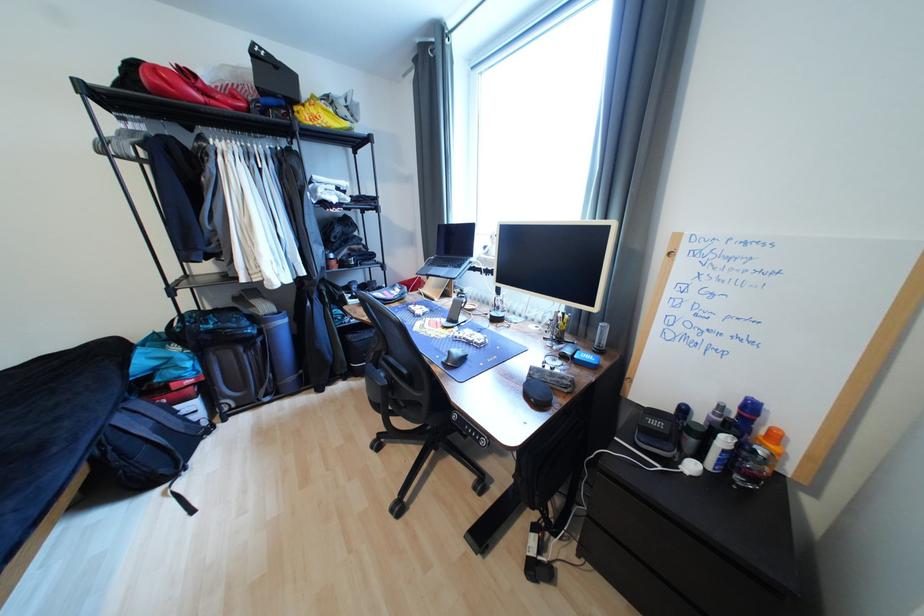
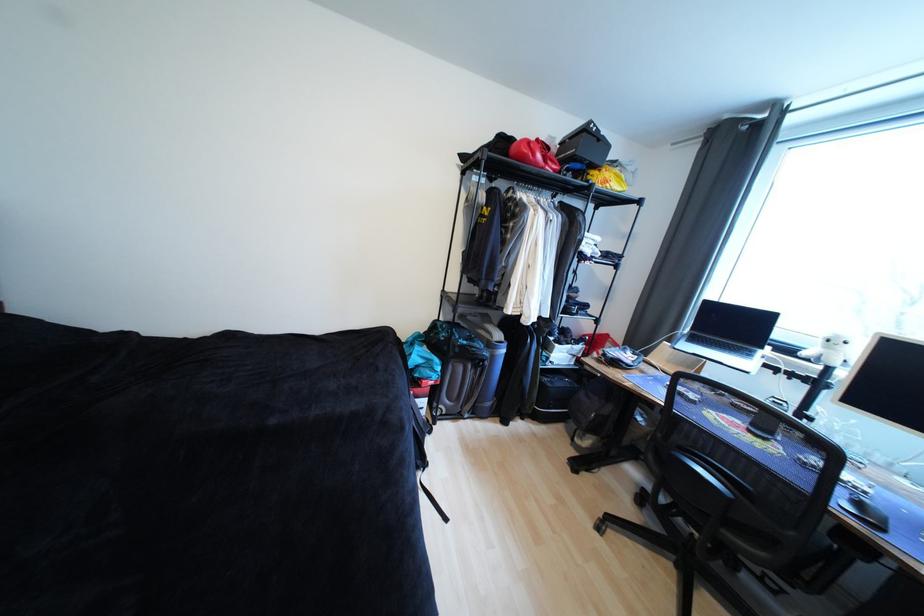
Find the pixel in the second image that matches point (216, 333) in the first image.

(469, 347)